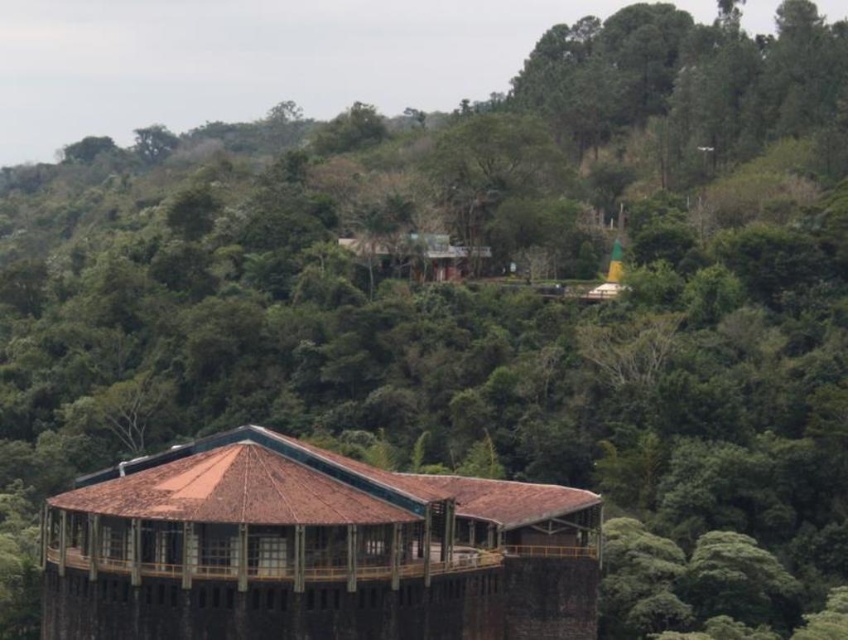
Which of these two, brown wooden gazebo at center or brown wooden hut at center, stands taller?

Standing taller between the two is brown wooden gazebo at center.

Does brown wooden gazebo at center have a greater width compared to brown wooden hut at center?

Correct, the width of brown wooden gazebo at center exceeds that of brown wooden hut at center.

At what (x,y) coordinates should I click in order to perform the action: click on brown wooden gazebo at center. Please return your answer as a coordinate pair (x, y). Image resolution: width=848 pixels, height=640 pixels. Looking at the image, I should click on (311, 548).